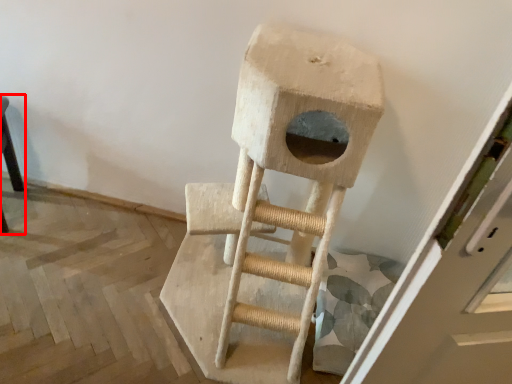
Question: In this image, where is furniture (annotated by the red box) located relative to ladder?

Choices:
 (A) right
 (B) left

Answer: (B)